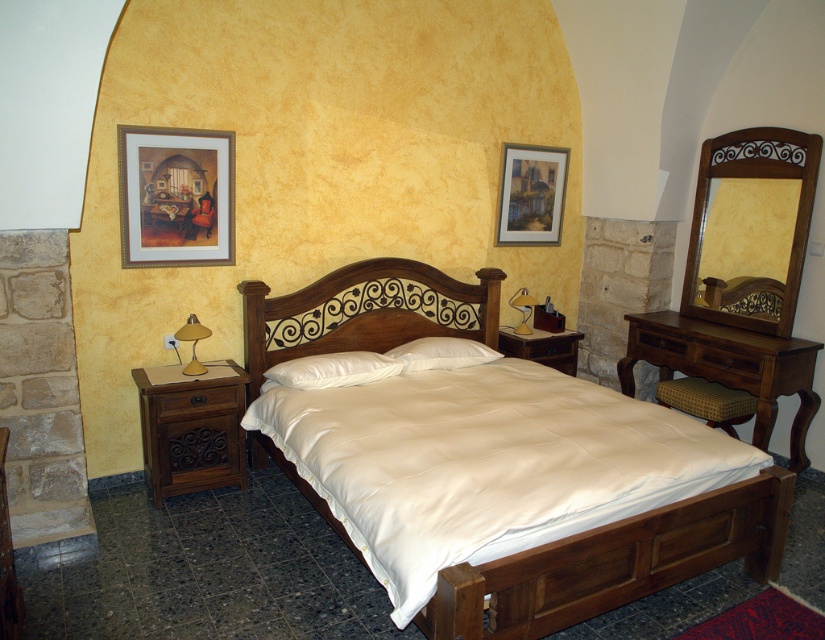
Question: Is the position of mahogany wood dresser at right less distant than that of matte gold lamp at right?

Choices:
 (A) yes
 (B) no

Answer: (A)

Question: Which object appears closest to the camera in this image?

Choices:
 (A) matte gold lamp at right
 (B) white satin pillow at center

Answer: (B)

Question: Considering the real-world distances, which object is closest to the yellow-green fabric ottoman at lower right?

Choices:
 (A) gold-framed painting at upper left
 (B) wooden bed frame at center
 (C) matte gold lamp at left
 (D) white soft pillow at center

Answer: (D)

Question: Estimate the real-world distances between objects in this image. Which object is closer to the brown wood nightstand at left?

Choices:
 (A) white satin pillow at center
 (B) matte gold lamp at right
 (C) gold-framed painting at upper left

Answer: (A)

Question: Is gold-framed painting at upper left below matte gold lamp at right?

Choices:
 (A) no
 (B) yes

Answer: (A)

Question: In this image, where is white satin bed at center located relative to white soft pillow at center?

Choices:
 (A) right
 (B) left

Answer: (A)